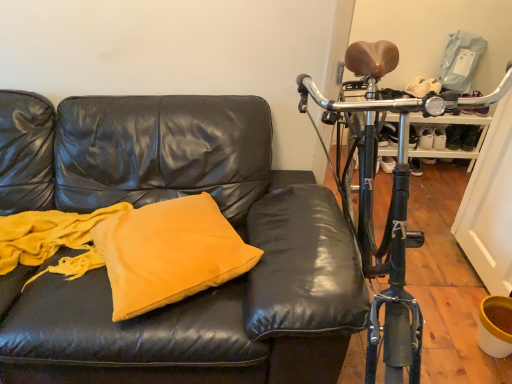
Describe the element at coordinates (168, 252) in the screenshot. I see `matte yellow pillow at center` at that location.

The height and width of the screenshot is (384, 512). I want to click on matte yellow pillow at center, so pos(168,252).

Measure the distance between matte yellow pillow at center and camera.

They are 3.89 feet apart.

What is the approximate height of matte yellow pillow at center?

The height of matte yellow pillow at center is 10.72 centimeters.

The width and height of the screenshot is (512, 384). Describe the element at coordinates (390, 201) in the screenshot. I see `shiny black bicycle at right` at that location.

Find the location of a particular element. The height and width of the screenshot is (384, 512). shiny black bicycle at right is located at coordinates (390, 201).

Measure the distance between point (x=500, y=89) and camera.

The distance of point (x=500, y=89) from camera is 4.96 feet.

You are a GUI agent. You are given a task and a screenshot of the screen. Output one action in this format:
    pyautogui.click(x=<x>, y=<y>)
    Task: Click on the matte yellow pillow at center
    
    Given the screenshot: What is the action you would take?
    pyautogui.click(x=168, y=252)

Considering the relative positions of shiny black bicycle at right and matte yellow pillow at center in the image provided, is shiny black bicycle at right to the left of matte yellow pillow at center from the viewer's perspective?

No, shiny black bicycle at right is not to the left of matte yellow pillow at center.

Is shiny black bicycle at right closer to camera compared to matte yellow pillow at center?

That is True.

Considering the positions of point (374, 365) and point (229, 261), is point (374, 365) closer or farther from the camera than point (229, 261)?

Point (374, 365) is positioned closer to the camera compared to point (229, 261).

From the image's perspective, who appears lower, shiny black bicycle at right or matte yellow pillow at center?

matte yellow pillow at center, from the image's perspective.

From a real-world perspective, is shiny black bicycle at right over matte yellow pillow at center?

Yes, from a real-world perspective, shiny black bicycle at right is on top of matte yellow pillow at center.

From the picture: Looking at their sizes, would you say shiny black bicycle at right is wider or thinner than matte yellow pillow at center?

shiny black bicycle at right is wider than matte yellow pillow at center.

Which of these two, shiny black bicycle at right or matte yellow pillow at center, stands shorter?

With less height is matte yellow pillow at center.

Looking at this image, considering the relative sizes of shiny black bicycle at right and matte yellow pillow at center in the image provided, is shiny black bicycle at right smaller than matte yellow pillow at center?

Incorrect, shiny black bicycle at right is not smaller in size than matte yellow pillow at center.

Is matte yellow pillow at center completely or partially inside shiny black bicycle at right?

Actually, matte yellow pillow at center is outside shiny black bicycle at right.

Is shiny black bicycle at right far away from matte yellow pillow at center?

No.

Is shiny black bicycle at right positioned with its back to matte yellow pillow at center?

No, shiny black bicycle at right is not facing the opposite direction of matte yellow pillow at center.

What's the angular difference between shiny black bicycle at right and matte yellow pillow at center's facing directions?

The facing directions of shiny black bicycle at right and matte yellow pillow at center are 32.4 degrees apart.

Measure the distance between shiny black bicycle at right and matte yellow pillow at center.

24.00 inches.

Locate an element on the screen. pillow beneath the shiny black bicycle at right (from a real-world perspective) is located at coordinates (168, 252).

Can you confirm if matte yellow pillow at center is positioned to the left of shiny black bicycle at right?

Indeed, matte yellow pillow at center is positioned on the left side of shiny black bicycle at right.

Does matte yellow pillow at center lie in front of shiny black bicycle at right?

No, matte yellow pillow at center is further to the viewer.

Is point (151, 286) in front of point (365, 171)?

Yes.

From the image's perspective, does matte yellow pillow at center appear lower than shiny black bicycle at right?

Correct, matte yellow pillow at center appears lower than shiny black bicycle at right in the image.

From a real-world perspective, is matte yellow pillow at center physically above shiny black bicycle at right?

No, from a real-world perspective, matte yellow pillow at center is not above shiny black bicycle at right.

Considering the relative sizes of matte yellow pillow at center and shiny black bicycle at right in the image provided, is matte yellow pillow at center thinner than shiny black bicycle at right?

Yes.

Can you confirm if matte yellow pillow at center is taller than shiny black bicycle at right?

No.

Is matte yellow pillow at center bigger than shiny black bicycle at right?

Actually, matte yellow pillow at center might be smaller than shiny black bicycle at right.

Is matte yellow pillow at center situated inside shiny black bicycle at right or outside?

matte yellow pillow at center exists outside the volume of shiny black bicycle at right.

Is matte yellow pillow at center far from shiny black bicycle at right?

No.

Is matte yellow pillow at center aimed at shiny black bicycle at right?

Yes, matte yellow pillow at center is oriented towards shiny black bicycle at right.

Locate an element on the screen. bicycle in front of the matte yellow pillow at center is located at coordinates (390, 201).

Locate an element on the screen. The height and width of the screenshot is (384, 512). bicycle that appears above the matte yellow pillow at center (from the image's perspective) is located at coordinates (390, 201).

The height and width of the screenshot is (384, 512). I want to click on pillow beneath the shiny black bicycle at right (from a real-world perspective), so click(168, 252).